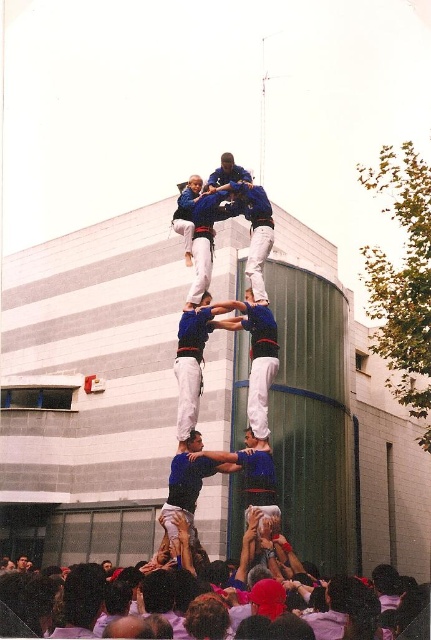
You are a photographer at the event and want to capture a closeup shot of the white cotton shirt at lower center and the blue fabric pants at center. Which object should you zoom in more on to ensure both are in frame?

The white cotton shirt at lower center has a larger size compared to blue fabric pants at center, so you should zoom in more on the blue fabric pants at center to ensure both are in frame.

You are a photographer standing in front of the human tower. You notice a white cotton shirt at lower center and a blue fabric pants at center. Which object is positioned more to the right side of the scene?

The white cotton shirt at lower center is positioned more to the right side of the scene compared to the blue fabric pants at center.